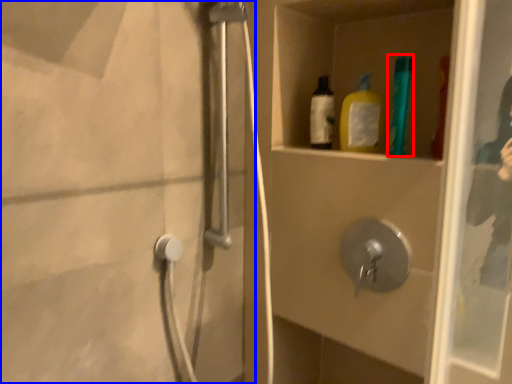
Question: Which object appears closest to the camera in this image, bottle (highlighted by a red box) or screen door (highlighted by a blue box)?

Choices:
 (A) bottle
 (B) screen door

Answer: (B)